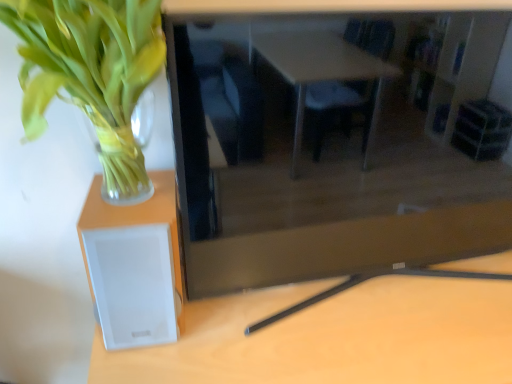
Locate an element on the screen. empty space that is ontop of white plastic speaker at lower left (from a real-world perspective) is located at coordinates (353, 319).